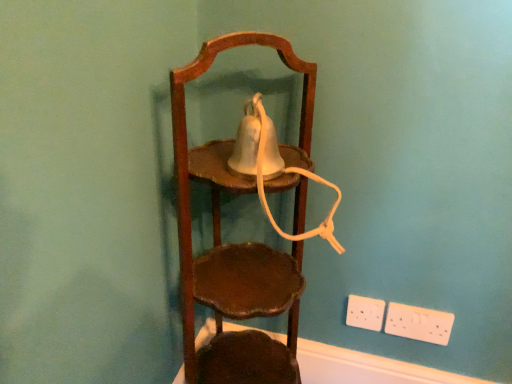
In order to face wooden bell stand at center, should I rotate leftwards or rightwards?

Turn right approximately 0.073 degrees to face it.

Where is `wooden bell stand at center`? wooden bell stand at center is located at coordinates (236, 244).

Describe the element at coordinates (236, 244) in the screenshot. I see `wooden bell stand at center` at that location.

Image resolution: width=512 pixels, height=384 pixels. What are the coordinates of `wooden bell stand at center` in the screenshot? It's located at (236, 244).